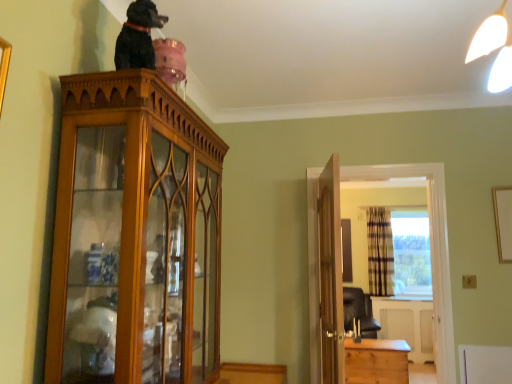
Where is `free spot above plaid fabric curtain at right (from a real-world perspective)`? The height and width of the screenshot is (384, 512). free spot above plaid fabric curtain at right (from a real-world perspective) is located at coordinates (378, 211).